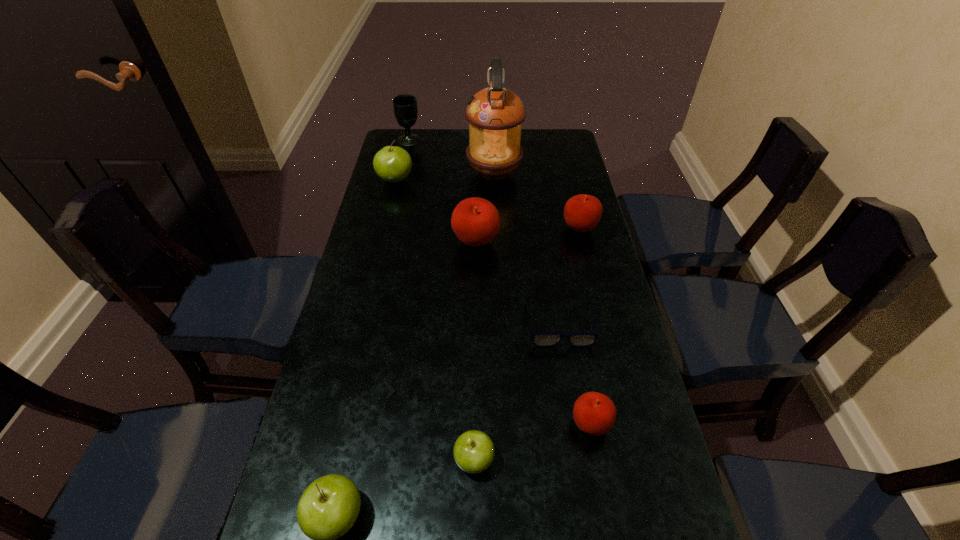
Locate an element on the screen. the fourth closest apple to the second smallest red apple is located at coordinates (473, 451).

What are the coordinates of `green apple that is the second closest to the leftmost red apple` in the screenshot? It's located at (473, 451).

Where is `green apple object that ranks as the third closest to the oil lamp`? green apple object that ranks as the third closest to the oil lamp is located at coordinates (328, 508).

Select which red apple is the second closest to the smallest green apple. Please provide its 2D coordinates. Your answer should be formatted as a tuple, i.e. [(x, y)], where the tuple contains the x and y coordinates of a point satisfying the conditions above.

[(475, 221)]

The image size is (960, 540). I want to click on red apple that stands as the closest to the nearest green apple, so click(x=594, y=413).